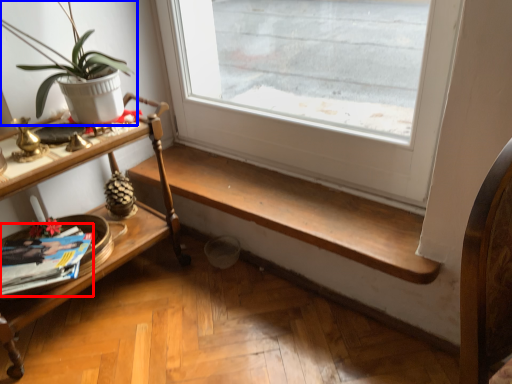
Question: Which object is further to the camera taking this photo, magazine (highlighted by a red box) or houseplant (highlighted by a blue box)?

Choices:
 (A) magazine
 (B) houseplant

Answer: (A)